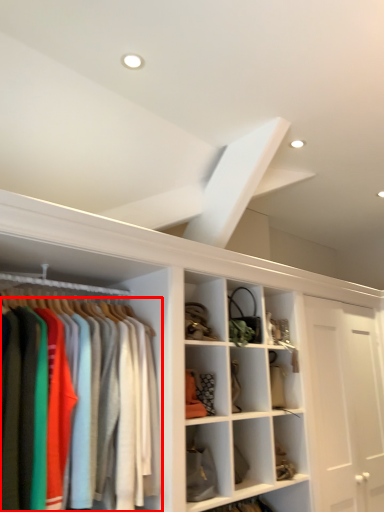
Question: In this image, where is clothing (annotated by the red box) located relative to exhaust hood?

Choices:
 (A) right
 (B) left

Answer: (B)